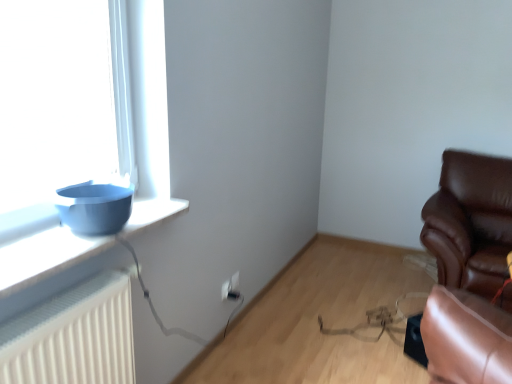
Question: Can you confirm if brown leather chair at right is wider than white plastic electric outlet at lower center?

Choices:
 (A) no
 (B) yes

Answer: (B)

Question: Can you confirm if brown leather chair at right is smaller than white plastic electric outlet at lower center?

Choices:
 (A) yes
 (B) no

Answer: (B)

Question: From a real-world perspective, is brown leather chair at right on white plastic electric outlet at lower center?

Choices:
 (A) yes
 (B) no

Answer: (A)

Question: Is brown leather chair at right to the right of white plastic electric outlet at lower center from the viewer's perspective?

Choices:
 (A) yes
 (B) no

Answer: (A)

Question: Does brown leather chair at right have a larger size compared to white plastic electric outlet at lower center?

Choices:
 (A) no
 (B) yes

Answer: (B)

Question: Is brown leather chair at right bigger or smaller than white plastic electric outlet at lower center?

Choices:
 (A) small
 (B) big

Answer: (B)

Question: Based on their positions, is brown leather chair at right located to the left or right of white plastic electric outlet at lower center?

Choices:
 (A) right
 (B) left

Answer: (A)

Question: From the image's perspective, is brown leather chair at right positioned above or below white plastic electric outlet at lower center?

Choices:
 (A) below
 (B) above

Answer: (B)

Question: From a real-world perspective, is brown leather chair at right above or below white plastic electric outlet at lower center?

Choices:
 (A) below
 (B) above

Answer: (B)

Question: Which is correct: matte blue bowl at left is inside white plastic electric outlet at lower center, or outside of it?

Choices:
 (A) inside
 (B) outside

Answer: (B)

Question: From the image's perspective, is matte blue bowl at left positioned above or below white plastic electric outlet at lower center?

Choices:
 (A) below
 (B) above

Answer: (B)

Question: Is matte blue bowl at left bigger or smaller than white plastic electric outlet at lower center?

Choices:
 (A) small
 (B) big

Answer: (B)

Question: Is matte blue bowl at left taller or shorter than white plastic electric outlet at lower center?

Choices:
 (A) tall
 (B) short

Answer: (B)

Question: Considering the positions of brown leather chair at right and matte blue bowl at left in the image, is brown leather chair at right wider or thinner than matte blue bowl at left?

Choices:
 (A) wide
 (B) thin

Answer: (A)

Question: Is point (501, 228) positioned closer to the camera than point (22, 244)?

Choices:
 (A) closer
 (B) farther

Answer: (B)